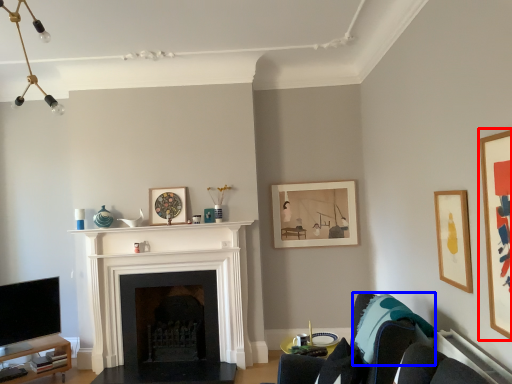
Question: Which of the following is the closest to the observer, picture frame (highlighted by a red box) or pillow (highlighted by a blue box)?

Choices:
 (A) picture frame
 (B) pillow

Answer: (A)